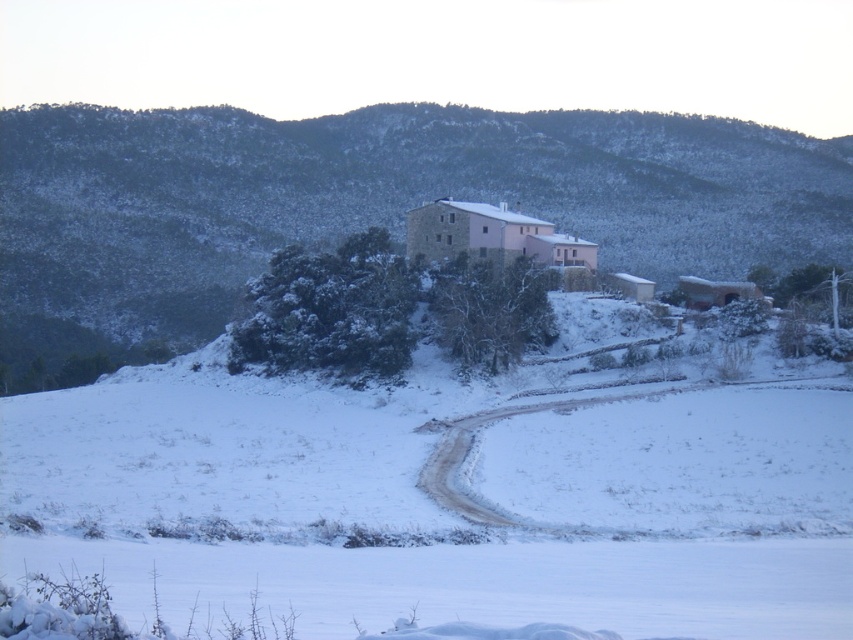
Question: From the image, what is the correct spatial relationship of white powdery snow at center in relation to snow-covered stone mountain at upper center?

Choices:
 (A) above
 (B) below

Answer: (B)

Question: Can you confirm if white powdery snow at center is wider than snow-covered stone mountain at upper center?

Choices:
 (A) yes
 (B) no

Answer: (B)

Question: Which point is closer to the camera taking this photo?

Choices:
 (A) (635, 448)
 (B) (15, 200)

Answer: (A)

Question: Which of the following is the farthest from the observer?

Choices:
 (A) snow-covered stone mountain at upper center
 (B) white powdery snow at center

Answer: (A)

Question: Is white powdery snow at center bigger than snow-covered stone mountain at upper center?

Choices:
 (A) no
 (B) yes

Answer: (A)